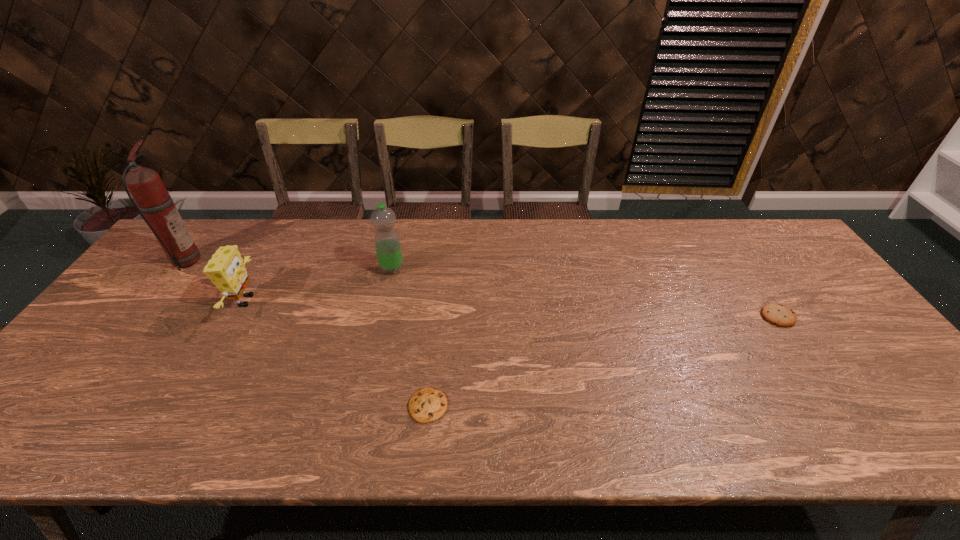
Find the location of `object that is at the far left corner`. object that is at the far left corner is located at coordinates (152, 200).

Where is `vacant space at the far edge`? This screenshot has width=960, height=540. vacant space at the far edge is located at coordinates (251, 221).

Where is `vacant space at the near edge of the desktop`? vacant space at the near edge of the desktop is located at coordinates (564, 440).

You are a GUI agent. You are given a task and a screenshot of the screen. Output one action in this format:
    pyautogui.click(x=<x>, y=<y>)
    Task: Click on the vacant space at the left edge
    The height and width of the screenshot is (540, 960).
    Given the screenshot: What is the action you would take?
    pyautogui.click(x=65, y=408)

The height and width of the screenshot is (540, 960). Identify the location of free region at the right edge of the desktop. (790, 281).

In the image, there is a desktop. At what (x,y) coordinates should I click in order to perform the action: click on vacant region at the far right corner. Please return your answer as a coordinate pair (x, y). This screenshot has height=540, width=960. Looking at the image, I should click on (756, 231).

Identify the location of vacant area that lies between the third shortest object and the right cookie. This screenshot has height=540, width=960. (512, 309).

What are the coordinates of `free space between the fourth object from right to left and the water bottle` in the screenshot? It's located at (319, 285).

Identify the location of free space between the taller cookie and the fourth shortest object. Image resolution: width=960 pixels, height=540 pixels. [585, 293].

You are a GUI agent. You are given a task and a screenshot of the screen. Output one action in this format:
    pyautogui.click(x=<x>, y=<y>)
    Task: Click on the free space between the sponge and the nearer cookie
    The width and height of the screenshot is (960, 540).
    Given the screenshot: What is the action you would take?
    pyautogui.click(x=337, y=353)